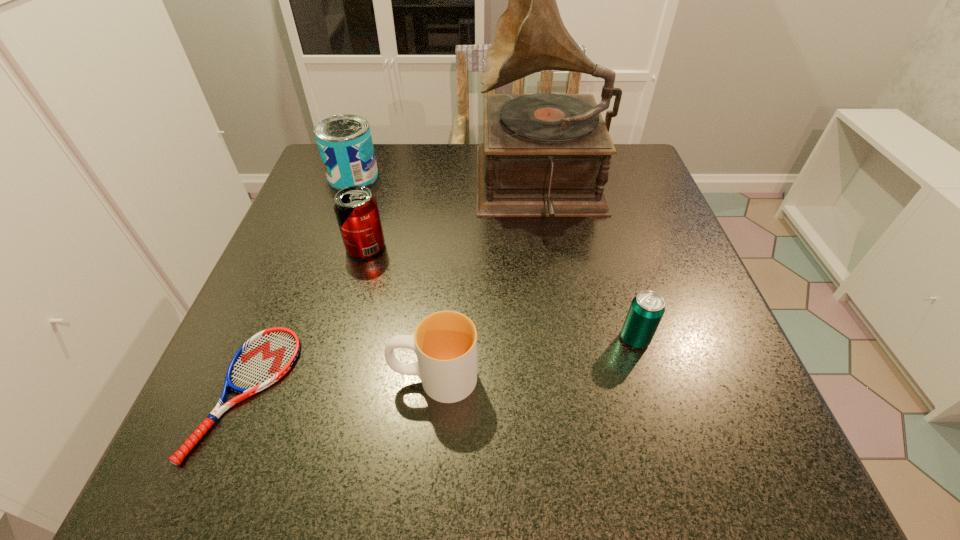
Where is `soda can at the left edge`? The width and height of the screenshot is (960, 540). soda can at the left edge is located at coordinates (356, 209).

Image resolution: width=960 pixels, height=540 pixels. What are the coordinates of `tennis racket that is at the left edge` in the screenshot? It's located at (266, 357).

The height and width of the screenshot is (540, 960). I want to click on record player at the right edge, so (544, 154).

In order to click on beer can that is at the right edge in this screenshot , I will do `click(646, 310)`.

Where is `object that is at the far left corner`? object that is at the far left corner is located at coordinates (345, 144).

Find the location of a particular element. This screenshot has width=960, height=540. object at the near left corner is located at coordinates (266, 357).

The image size is (960, 540). I want to click on object present at the far right corner, so click(544, 154).

The width and height of the screenshot is (960, 540). I want to click on vacant region at the far edge of the desktop, so click(391, 173).

This screenshot has height=540, width=960. Find the location of `vacant space at the near edge of the desktop`. vacant space at the near edge of the desktop is located at coordinates (651, 463).

Where is `vacant space at the left edge of the desktop`? This screenshot has height=540, width=960. vacant space at the left edge of the desktop is located at coordinates (284, 248).